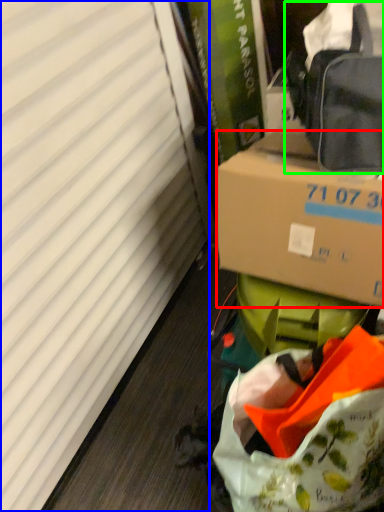
Question: Which object is positioned farthest from box (highlighted by a red box)? Select from curtain (highlighted by a blue box) and pack (highlighted by a green box).

Choices:
 (A) curtain
 (B) pack

Answer: (A)